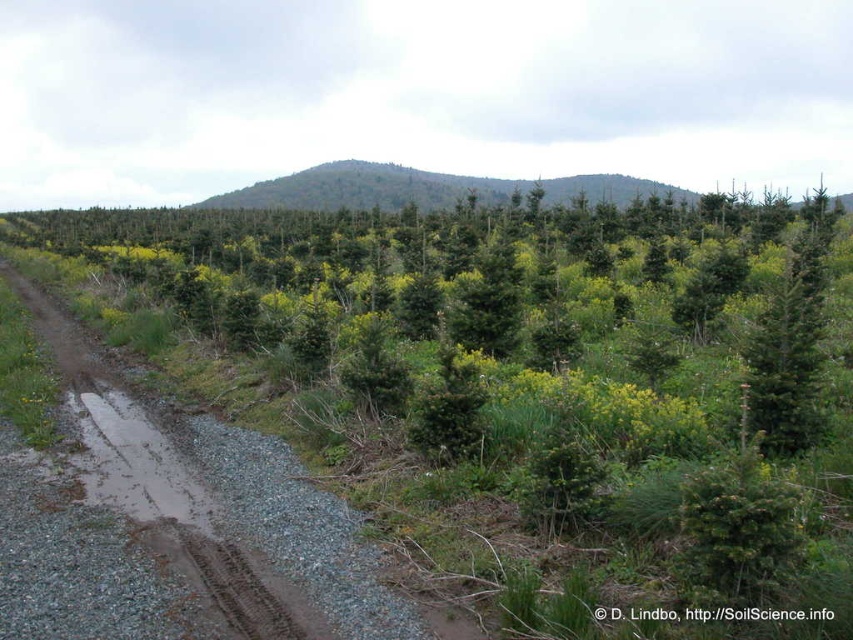
You are a hiker standing at the edge of the brown gravel road at left. You want to reach the green forested mountain at center. Which direction should you head towards?

You should head towards the right, since the brown gravel road at left is to the left of the green forested mountain at center, so moving right along the road would lead you towards the mountain.